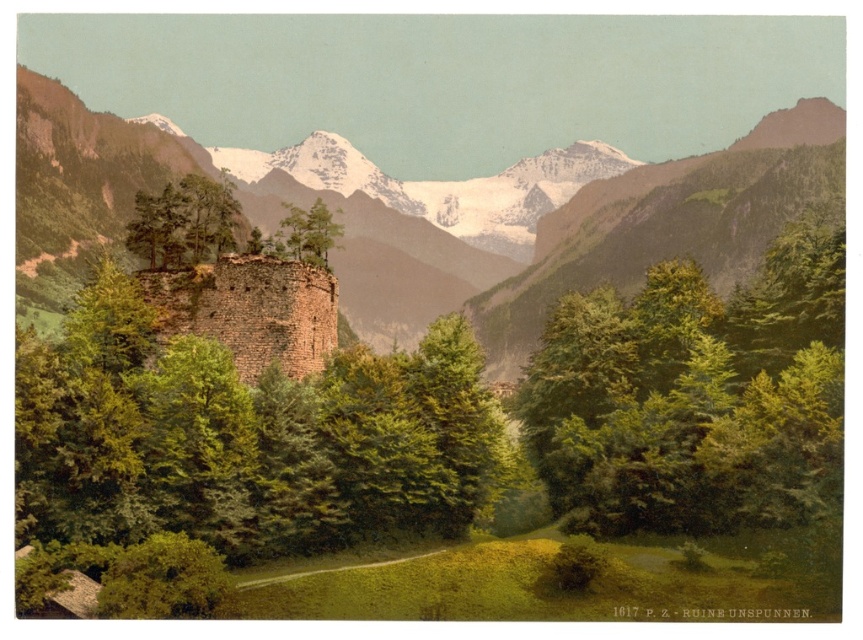
You are standing at the point marked by the coordinates point [690,396] in the image. What object is located exactly at that point?

The point [690,396] indicates a green leafy tree at center.